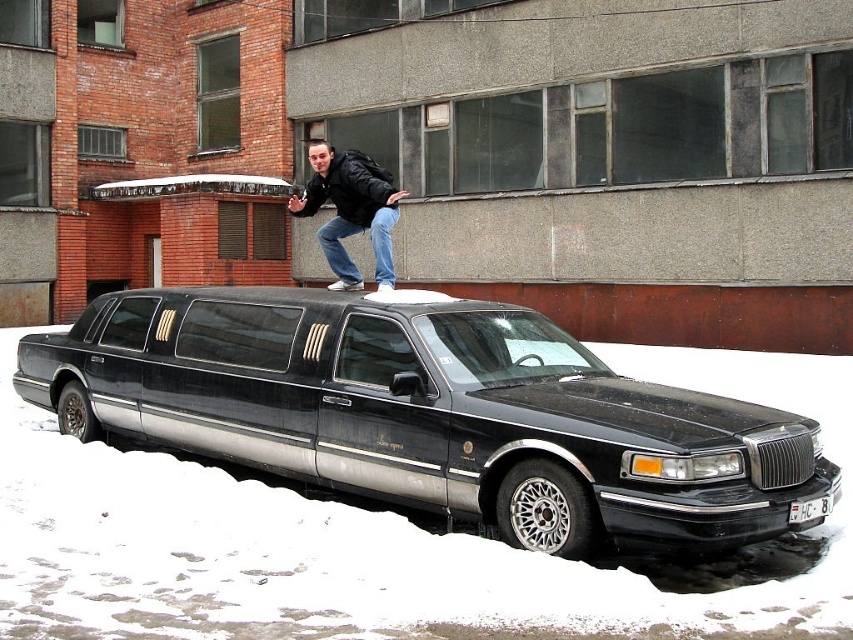
Does leather jacket at center appear on the right side of white plastic license plate at center?

No, leather jacket at center is not to the right of white plastic license plate at center.

Who is positioned more to the right, leather jacket at center or white plastic license plate at center?

Positioned to the right is white plastic license plate at center.

Does point (311, 141) lie in front of point (828, 497)?

No, (311, 141) is further to viewer.

Identify the location of leather jacket at center. The image size is (853, 640). (350, 211).

Who is more distant from viewer, (741, 500) or (814, 515)?

Point (814, 515)

Image resolution: width=853 pixels, height=640 pixels. In order to click on black metallic limousine at center in this screenshot , I will do `click(428, 412)`.

What are the coordinates of `black metallic limousine at center` in the screenshot? It's located at (428, 412).

Which is more to the left, black metallic limousine at center or leather jacket at center?

From the viewer's perspective, leather jacket at center appears more on the left side.

Who is shorter, black metallic limousine at center or leather jacket at center?

leather jacket at center

This screenshot has width=853, height=640. What do you see at coordinates (428, 412) in the screenshot? I see `black metallic limousine at center` at bounding box center [428, 412].

In order to click on black metallic limousine at center in this screenshot , I will do (x=428, y=412).